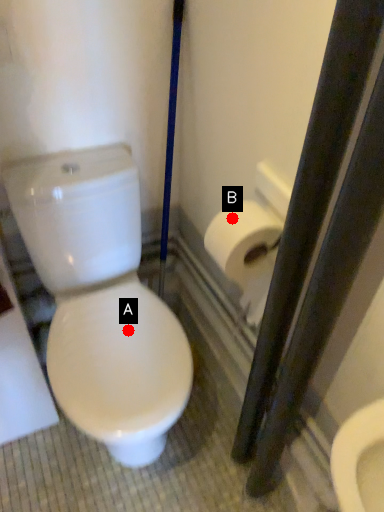
Question: Two points are circled on the image, labeled by A and B beside each circle. Which point is closer to the camera?

Choices:
 (A) A is closer
 (B) B is closer

Answer: (B)